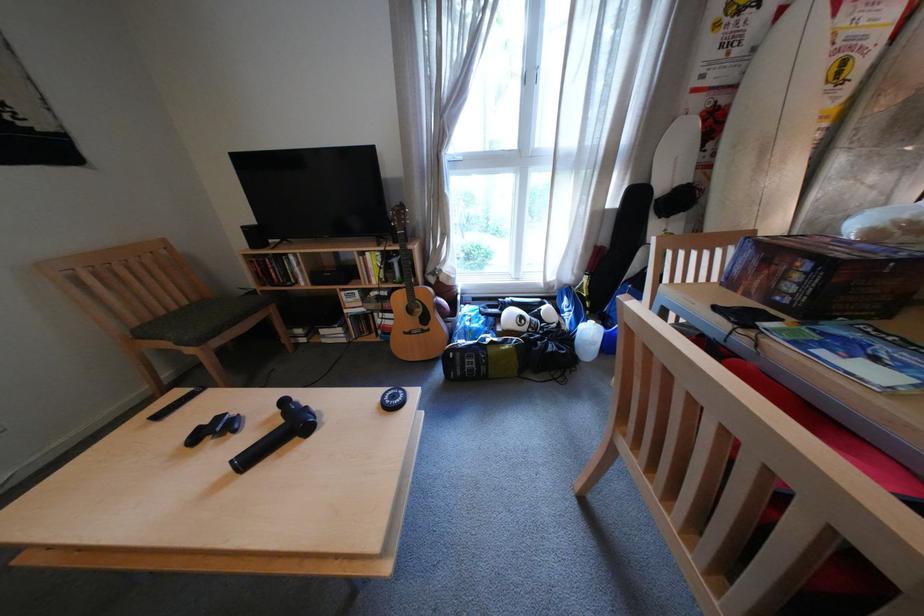
Where is `plastic jug handle`? plastic jug handle is located at coordinates (590, 336).